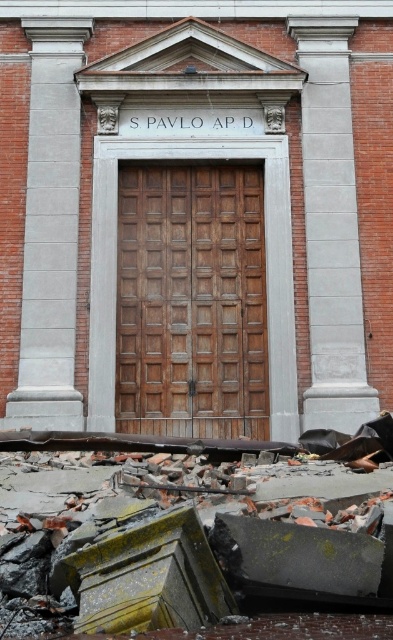
Question: Among these points, which one is farthest from the camera?

Choices:
 (A) (303, 36)
 (B) (77, 256)

Answer: (A)

Question: Can you confirm if wooden panelled door at center is positioned below gray concrete column at right?

Choices:
 (A) no
 (B) yes

Answer: (B)

Question: Does gray concrete column at left come in front of gray concrete column at right?

Choices:
 (A) no
 (B) yes

Answer: (B)

Question: Which is farther from the wooden panelled door at center?

Choices:
 (A) gray concrete column at right
 (B) gray concrete column at left

Answer: (B)

Question: Can you confirm if wooden panelled door at center is positioned to the left of gray concrete column at left?

Choices:
 (A) yes
 (B) no

Answer: (B)

Question: Which object appears closest to the camera in this image?

Choices:
 (A) wooden panelled door at center
 (B) gray concrete column at right
 (C) gray concrete column at left

Answer: (C)